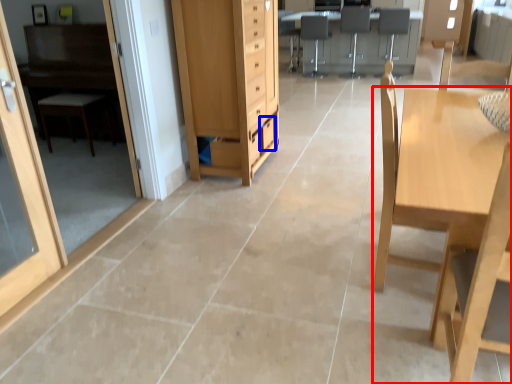
Question: Which point is closer to the camera, table (highlighted by a red box) or drawer (highlighted by a blue box)?

Choices:
 (A) table
 (B) drawer

Answer: (A)